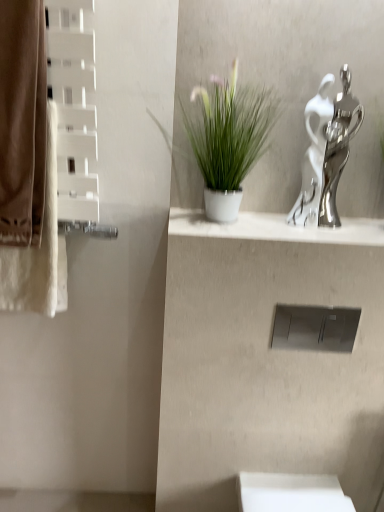
Measure the distance between point (42,289) and camera.

Point (42,289) and camera are 1.27 meters apart from each other.

In order to face white glossy vase at upper center, should I rotate leftwards or rightwards?

It's best to rotate right around 11.946 degrees.

Where is `silver metallic sculpture at upper right`? The width and height of the screenshot is (384, 512). silver metallic sculpture at upper right is located at coordinates (326, 153).

Find the location of a particular element. This screenshot has height=512, width=384. brown fabric curtain at left is located at coordinates (22, 122).

Consider the image. Could you tell me if white glossy vase at upper center is facing silver metallic sculpture at upper right?

No, white glossy vase at upper center does not turn towards silver metallic sculpture at upper right.

Which of these two, white glossy vase at upper center or silver metallic sculpture at upper right, is smaller?

white glossy vase at upper center is smaller.

Identify the location of balustrade behind the silver metallic sculpture at upper right. The width and height of the screenshot is (384, 512). (275, 229).

Between brown fabric curtain at left and green matte plant at center, which one appears on the right side from the viewer's perspective?

green matte plant at center.

Is green matte plant at center surrounded by brown fabric curtain at left?

No, green matte plant at center is not surrounded by brown fabric curtain at left.

From a real-world perspective, who is located lower, brown fabric curtain at left or green matte plant at center?

In real-world perspective, brown fabric curtain at left is lower.

Consider the image. Can you confirm if brown fabric curtain at left is bigger than green matte plant at center?

No.

Does brown cotton bath towel at left turn towards brown fabric curtain at left?

Yes, brown cotton bath towel at left faces towards brown fabric curtain at left.

Locate an element on the screen. This screenshot has height=512, width=384. curtain above the brown cotton bath towel at left (from a real-world perspective) is located at coordinates (22, 122).

How far apart are brown cotton bath towel at left and brown fabric curtain at left?

brown cotton bath towel at left and brown fabric curtain at left are 4.33 inches apart.

Is brown cotton bath towel at left far from brown fabric curtain at left?

No, brown cotton bath towel at left is not far away from brown fabric curtain at left.

Does brown cotton bath towel at left come in front of white glossy vase at upper center?

Yes, brown cotton bath towel at left is in front of white glossy vase at upper center.

Are brown cotton bath towel at left and white glossy vase at upper center located far from each other?

No.

Find the location of `bath towel lying on the left of white glossy vase at upper center`. bath towel lying on the left of white glossy vase at upper center is located at coordinates (39, 251).

Is white glossy vase at upper center completely or partially inside brown cotton bath towel at left?

Actually, white glossy vase at upper center is outside brown cotton bath towel at left.

At what (x,y) coordinates should I click in order to perform the action: click on bath towel located underneath the silver metallic sculpture at upper right (from a real-world perspective). Please return your answer as a coordinate pair (x, y). Looking at the image, I should click on (39, 251).

Looking at their sizes, would you say brown cotton bath towel at left is wider or thinner than silver metallic sculpture at upper right?

brown cotton bath towel at left is wider than silver metallic sculpture at upper right.

From the image's perspective, is brown cotton bath towel at left below silver metallic sculpture at upper right?

Yes, from the image's perspective, brown cotton bath towel at left is beneath silver metallic sculpture at upper right.

Considering the points (12, 288) and (310, 220), which point is in front, point (12, 288) or point (310, 220)?

Point (310, 220)

Looking at the image, does green matte plant at center seem bigger or smaller compared to silver metallic sculpture at upper right?

Clearly, green matte plant at center is larger in size than silver metallic sculpture at upper right.

From a real-world perspective, which object stands above the other?

From a 3D spatial view, silver metallic sculpture at upper right is above.

Is green matte plant at center turned away from silver metallic sculpture at upper right?

No.

Image resolution: width=384 pixels, height=512 pixels. I want to click on sculpture that appears above the green matte plant at center (from a real-world perspective), so click(x=326, y=153).

Is silver metallic sculpture at upper right at the back of brown fabric curtain at left?

No, brown fabric curtain at left is not facing the opposite direction of silver metallic sculpture at upper right.

From the image's perspective, relative to silver metallic sculpture at upper right, is brown fabric curtain at left above or below?

Based on their image positions, brown fabric curtain at left is located above silver metallic sculpture at upper right.

Between brown fabric curtain at left and silver metallic sculpture at upper right, which one appears on the left side from the viewer's perspective?

brown fabric curtain at left.

Where is `curtain that appears above the silver metallic sculpture at upper right (from the image's perspective)`? The width and height of the screenshot is (384, 512). curtain that appears above the silver metallic sculpture at upper right (from the image's perspective) is located at coordinates (22, 122).

Where is `sculpture in front of the white glossy vase at upper center`? Image resolution: width=384 pixels, height=512 pixels. sculpture in front of the white glossy vase at upper center is located at coordinates (326, 153).

Identify the location of houseplant above the brown fabric curtain at left (from a real-world perspective). The image size is (384, 512). (229, 140).

From the picture: Based on their spatial positions, is green matte plant at center or silver metallic sculpture at upper right further from brown fabric curtain at left?

silver metallic sculpture at upper right is further to brown fabric curtain at left.

Estimate the real-world distances between objects in this image. Which object is further from white glossy vase at upper center, green matte plant at center or brown fabric curtain at left?

The object further to white glossy vase at upper center is brown fabric curtain at left.

Estimate the real-world distances between objects in this image. Which object is further from brown fabric curtain at left, white glossy vase at upper center or brown cotton bath towel at left?

The object further to brown fabric curtain at left is white glossy vase at upper center.

From the image, which object appears to be farther from brown fabric curtain at left, silver metallic sculpture at upper right or white glossy vase at upper center?

silver metallic sculpture at upper right lies further to brown fabric curtain at left than the other object.

Considering their positions, is white glossy vase at upper center positioned closer to silver metallic sculpture at upper right than green matte plant at center?

Based on the image, white glossy vase at upper center appears to be nearer to silver metallic sculpture at upper right.

Estimate the real-world distances between objects in this image. Which object is closer to silver metallic sculpture at upper right, brown cotton bath towel at left or white glossy vase at upper center?

white glossy vase at upper center lies closer to silver metallic sculpture at upper right than the other object.

From the picture: Based on their spatial positions, is silver metallic sculpture at upper right or white glossy vase at upper center further from brown cotton bath towel at left?

Among the two, silver metallic sculpture at upper right is located further to brown cotton bath towel at left.

Estimate the real-world distances between objects in this image. Which object is closer to brown cotton bath towel at left, green matte plant at center or silver metallic sculpture at upper right?

green matte plant at center.

Locate an element on the screen. houseplant situated between brown fabric curtain at left and silver metallic sculpture at upper right from left to right is located at coordinates (229, 140).

Image resolution: width=384 pixels, height=512 pixels. Find the location of `balustrade situated between green matte plant at center and silver metallic sculpture at upper right from left to right`. balustrade situated between green matte plant at center and silver metallic sculpture at upper right from left to right is located at coordinates (x=275, y=229).

Find the location of `houseplant between brown cotton bath towel at left and silver metallic sculpture at upper right in the horizontal direction`. houseplant between brown cotton bath towel at left and silver metallic sculpture at upper right in the horizontal direction is located at coordinates 229,140.

This screenshot has width=384, height=512. Find the location of `curtain between brown cotton bath towel at left and green matte plant at center in the horizontal direction`. curtain between brown cotton bath towel at left and green matte plant at center in the horizontal direction is located at coordinates (22, 122).